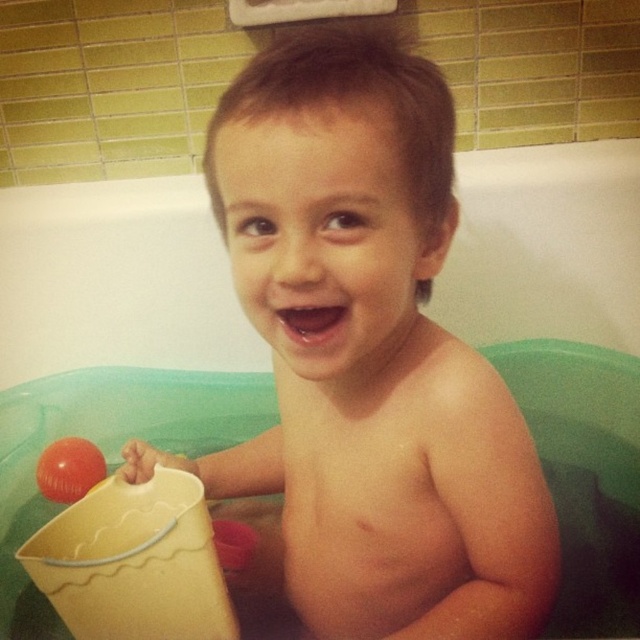
Question: Is smooth skin child at center smaller than rubber ball at left?

Choices:
 (A) no
 (B) yes

Answer: (A)

Question: Which point is farther from the camera taking this photo?

Choices:
 (A) (74, 477)
 (B) (464, 417)

Answer: (A)

Question: Where is smooth skin child at center located in relation to rubber ball at left in the image?

Choices:
 (A) right
 (B) left

Answer: (A)

Question: Which point is farther to the camera?

Choices:
 (A) rubber ball at left
 (B) smooth skin child at center

Answer: (A)

Question: Does smooth skin child at center appear on the left side of rubber ball at left?

Choices:
 (A) yes
 (B) no

Answer: (B)